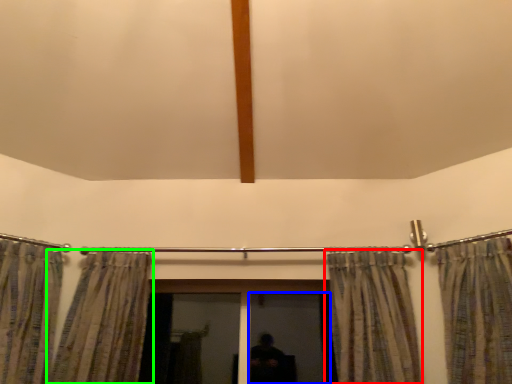
Question: Which is farther away from curtain (highlighted by a red box)? screen door (highlighted by a blue box) or curtain (highlighted by a green box)?

Choices:
 (A) screen door
 (B) curtain

Answer: (B)